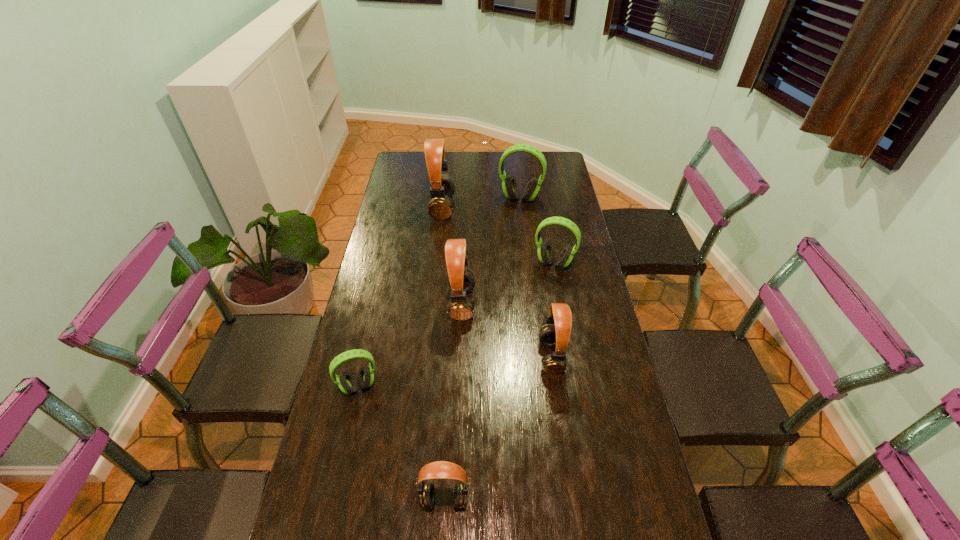
Where is `vacant region located on the right of the nearest green headset`? This screenshot has height=540, width=960. vacant region located on the right of the nearest green headset is located at coordinates (442, 386).

In order to click on free region located 0.050m on the ear cups of the nearest headset in this screenshot , I will do `click(443, 536)`.

The width and height of the screenshot is (960, 540). I want to click on object that is at the left edge, so [x=347, y=384].

At what (x,y) coordinates should I click in order to perform the action: click on vacant space at the far edge. Please return your answer as a coordinate pair (x, y). Image resolution: width=960 pixels, height=540 pixels. Looking at the image, I should click on (478, 160).

This screenshot has height=540, width=960. Identify the location of vacant space at the left edge. (406, 214).

This screenshot has height=540, width=960. I want to click on vacant space at the right edge, so click(x=570, y=271).

The image size is (960, 540). In order to click on unoccupied position between the rightmost brown headset and the biggest green headset in this screenshot , I will do pyautogui.click(x=536, y=278).

Identify the location of vacant area that lies between the tallest headset and the biggest green headset. (481, 203).

The image size is (960, 540). I want to click on free space between the leftmost object and the fourth nearest headset, so click(410, 345).

This screenshot has height=540, width=960. In order to click on unoccupied position between the fourth farthest object and the second biggest green headset in this screenshot , I will do `click(508, 284)`.